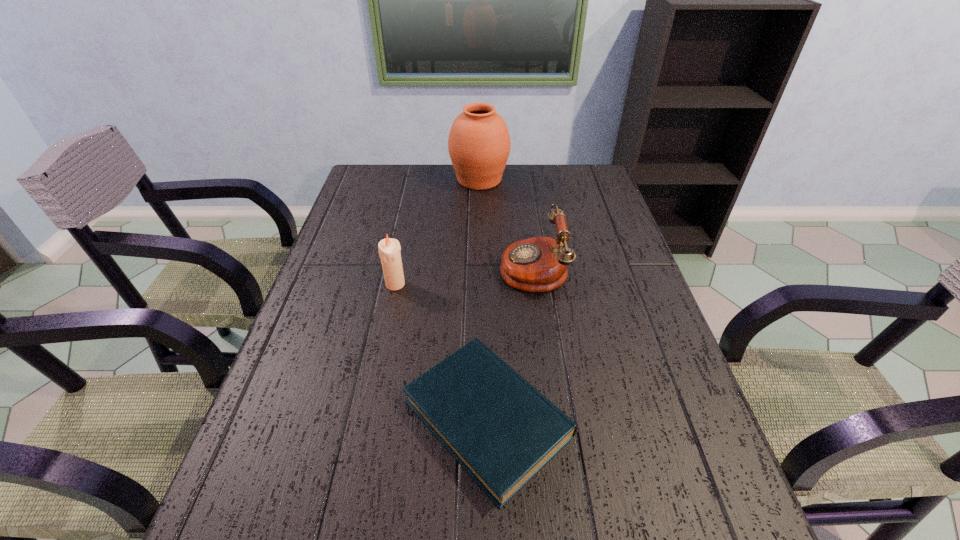
You are a GUI agent. You are given a task and a screenshot of the screen. Output one action in this format:
    pyautogui.click(x=<x>, y=<y>)
    Task: Click on the vacant space situated 0.140m on the right of the candle
    Image resolution: width=960 pixels, height=540 pixels.
    Given the screenshot: What is the action you would take?
    pyautogui.click(x=459, y=284)

The image size is (960, 540). Find the location of `vacant space situated on the back of the book`. vacant space situated on the back of the book is located at coordinates (485, 257).

This screenshot has width=960, height=540. What are the coordinates of `object that is at the far edge` in the screenshot? It's located at [479, 143].

Locate an element on the screen. Image resolution: width=960 pixels, height=540 pixels. vacant space at the far edge of the desktop is located at coordinates (429, 195).

The width and height of the screenshot is (960, 540). Find the location of `vacant space at the left edge of the desktop`. vacant space at the left edge of the desktop is located at coordinates (300, 312).

Locate an element on the screen. Image resolution: width=960 pixels, height=540 pixels. vacant space at the right edge is located at coordinates (605, 206).

I want to click on blank area at the far left corner, so click(x=406, y=168).

Identify the location of vacant space at the far right corner of the desktop. Image resolution: width=960 pixels, height=540 pixels. (588, 197).

This screenshot has height=540, width=960. I want to click on free space between the candle and the telephone, so click(x=464, y=275).

Locate an element on the screen. This screenshot has height=540, width=960. empty space between the tallest object and the telephone is located at coordinates (506, 222).